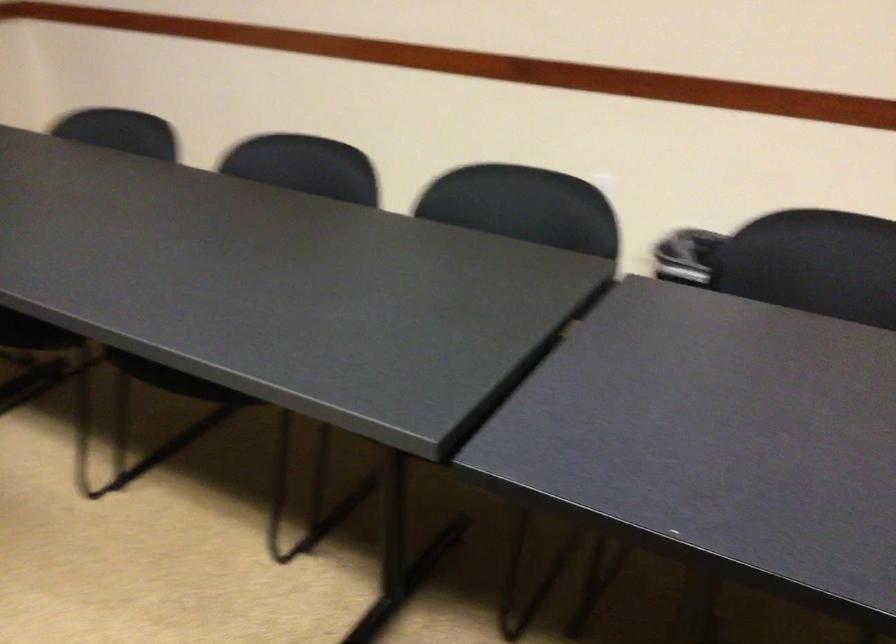
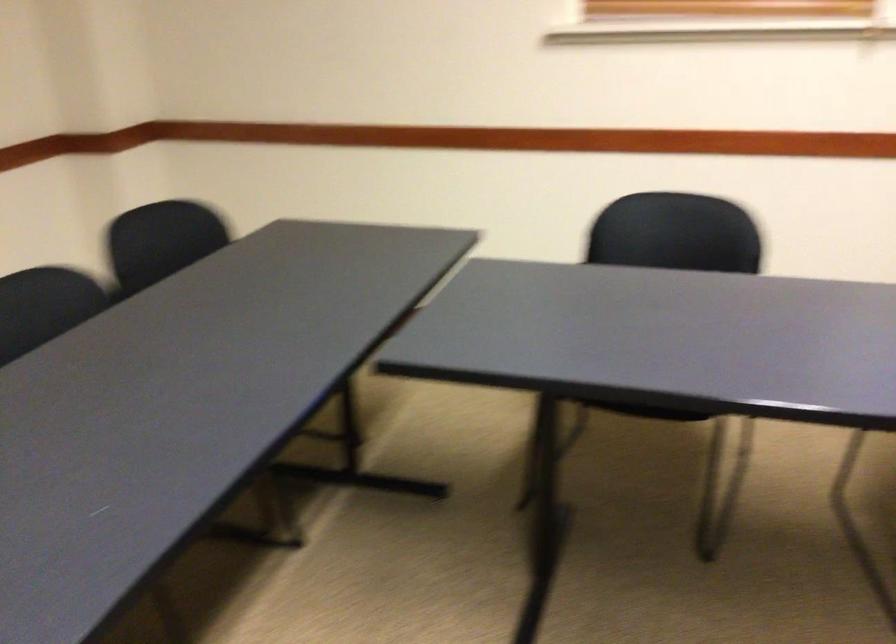
First-person continuous shooting, in which direction is the camera rotating?

The rotation direction of the camera is right-down.